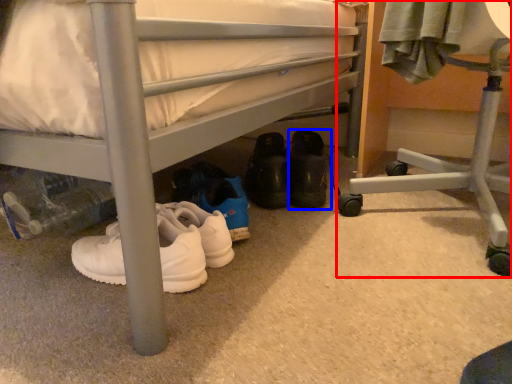
Question: Which object is further to the camera taking this photo, furniture (highlighted by a red box) or footwear (highlighted by a blue box)?

Choices:
 (A) furniture
 (B) footwear

Answer: (B)